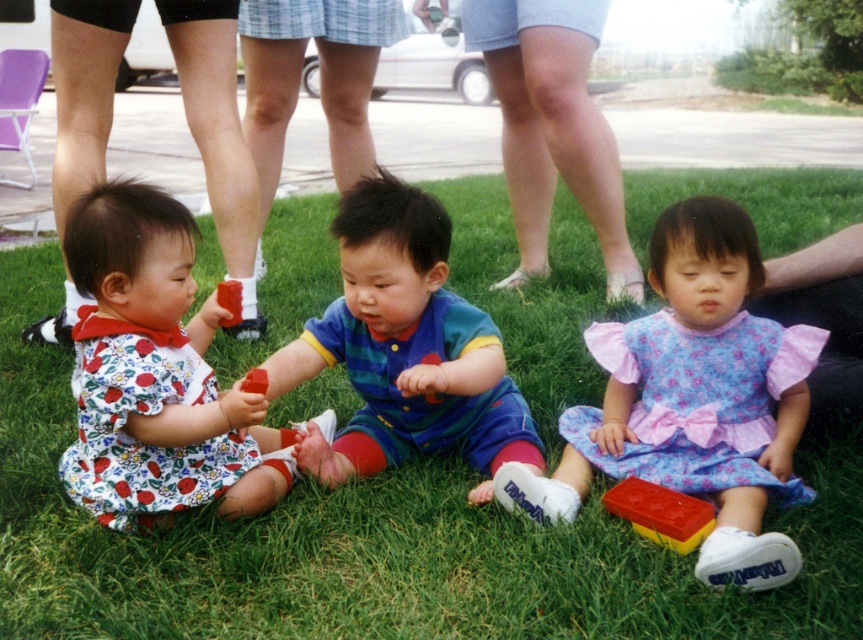
In the scene shown: Can you confirm if green grass at center is positioned to the left of floral cotton dress at lower left?

Incorrect, green grass at center is not on the left side of floral cotton dress at lower left.

Who is lower down, green grass at center or floral cotton dress at lower left?

green grass at center is lower down.

Who is more distant from viewer, (632, 234) or (87, 483)?

The point (632, 234) is more distant.

Find the location of a particular element. green grass at center is located at coordinates (373, 544).

Which is more to the right, floral cotton dress at lower right or floral fabric dress at left?

Positioned to the right is floral cotton dress at lower right.

Can you confirm if floral cotton dress at lower right is bigger than floral fabric dress at left?

No.

You are a GUI agent. You are given a task and a screenshot of the screen. Output one action in this format:
    pyautogui.click(x=<x>, y=<y>)
    Task: Click on the floral cotton dress at lower right
    The height and width of the screenshot is (640, 863).
    Given the screenshot: What is the action you would take?
    pyautogui.click(x=694, y=397)

You are a GUI agent. You are given a task and a screenshot of the screen. Output one action in this format:
    pyautogui.click(x=<x>, y=<y>)
    Task: Click on the floral cotton dress at lower right
    The image size is (863, 640).
    Given the screenshot: What is the action you would take?
    pyautogui.click(x=694, y=397)

Can you confirm if floral cotton dress at lower right is smaller than floral cotton dress at lower left?

No.

From the picture: Who is shorter, floral cotton dress at lower right or floral cotton dress at lower left?

floral cotton dress at lower left

In the scene shown: Who is more distant from viewer, (779,330) or (156,225)?

The point (779,330) is more distant.

Locate an element on the screen. This screenshot has width=863, height=640. floral cotton dress at lower right is located at coordinates (694, 397).